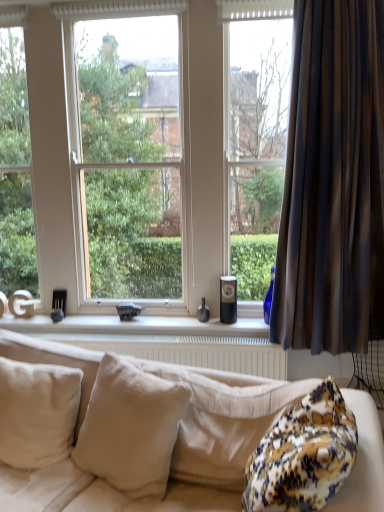
Question: Based on their positions, is beige fabric pillow at center, acting as the 2th pillow starting from the left, located to the left or right of transparent glass window at center?

Choices:
 (A) right
 (B) left

Answer: (A)

Question: Relative to transparent glass window at center, is beige fabric pillow at center, arranged as the first pillow when viewed from the right, in front or behind?

Choices:
 (A) front
 (B) behind

Answer: (A)

Question: Which is farther from the transparent glass window at center?

Choices:
 (A) beige cotton pillow at lower left, which is counted as the second pillow, starting from the right
 (B) brown striped curtain at right
 (C) beige fabric couch at lower center
 (D) white matte window sill at center
 (E) white textured radiator at lower center

Answer: (C)

Question: Considering the real-world distances, which object is farthest from the beige fabric couch at lower center?

Choices:
 (A) white matte window sill at center
 (B) transparent glass window at center
 (C) white textured radiator at lower center
 (D) beige fabric pillow at center, acting as the 2th pillow starting from the left
 (E) brown striped curtain at right

Answer: (E)